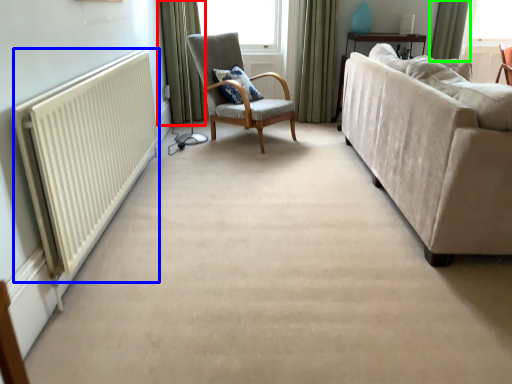
Question: Which is farther away from curtain (highlighted by a red box)? radiator (highlighted by a blue box) or curtain (highlighted by a green box)?

Choices:
 (A) radiator
 (B) curtain

Answer: (B)